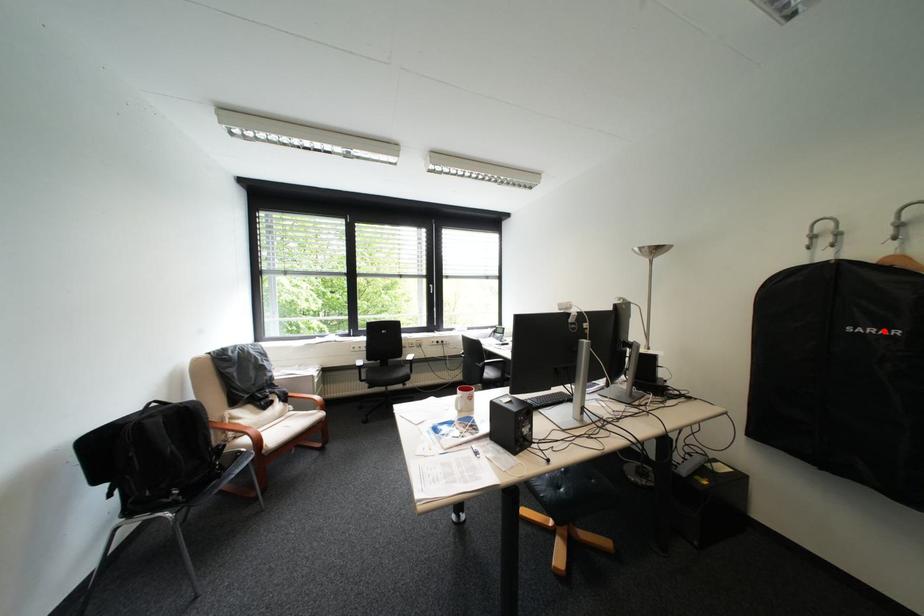
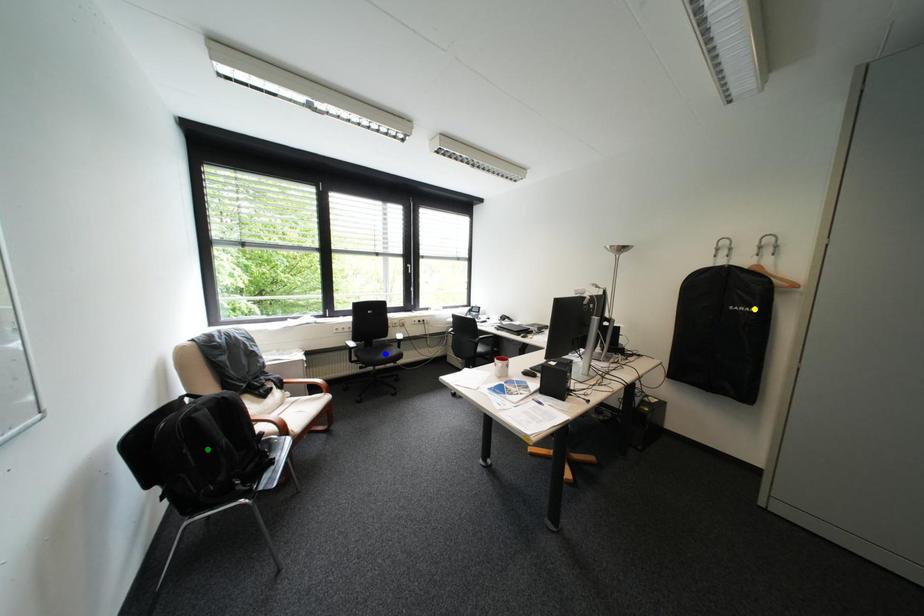
Question: I am providing you with two images of the same scene from different viewpoints. A red point is marked on the first image. You are given multiple points on the second image. In image 2, which mark is for the same physical point as the one in image 1?

Choices:
 (A) blue point
 (B) yellow point
 (C) green point

Answer: (B)